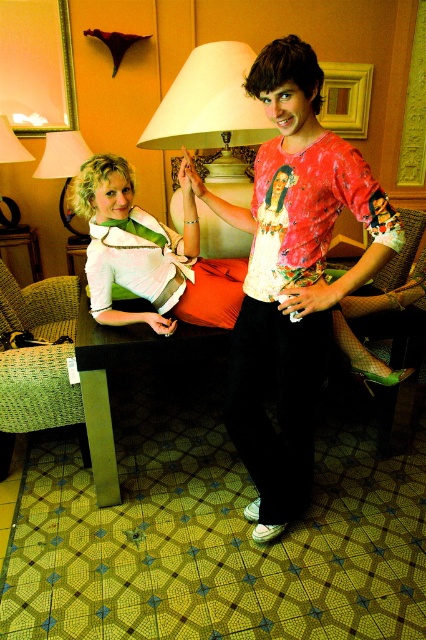
Question: Among these objects, which one is farthest from the camera?

Choices:
 (A) white fabric lampshade at center
 (B) matte green blouse at center
 (C) matte white lampshade at upper center

Answer: (C)

Question: Is the position of matte white lampshade at upper center more distant than that of matte white lampshade at upper left?

Choices:
 (A) yes
 (B) no

Answer: (B)

Question: Considering the real-world distances, which object is closest to the velvet orange pillow at center?

Choices:
 (A) matte white lampshade at upper left
 (B) matte white lampshade at upper center
 (C) matte green blouse at center
 (D) white fabric lampshade at center

Answer: (C)

Question: Is white fabric lampshade at center thinner than matte white lampshade at upper center?

Choices:
 (A) no
 (B) yes

Answer: (A)

Question: Is matte green blouse at center bigger than matte white lampshade at upper left?

Choices:
 (A) yes
 (B) no

Answer: (A)

Question: Which object is positioned farthest from the velvet orange pillow at center?

Choices:
 (A) matte white lampshade at upper center
 (B) matte white lampshade at upper left
 (C) matte green blouse at center
 (D) white fabric lampshade at center

Answer: (B)